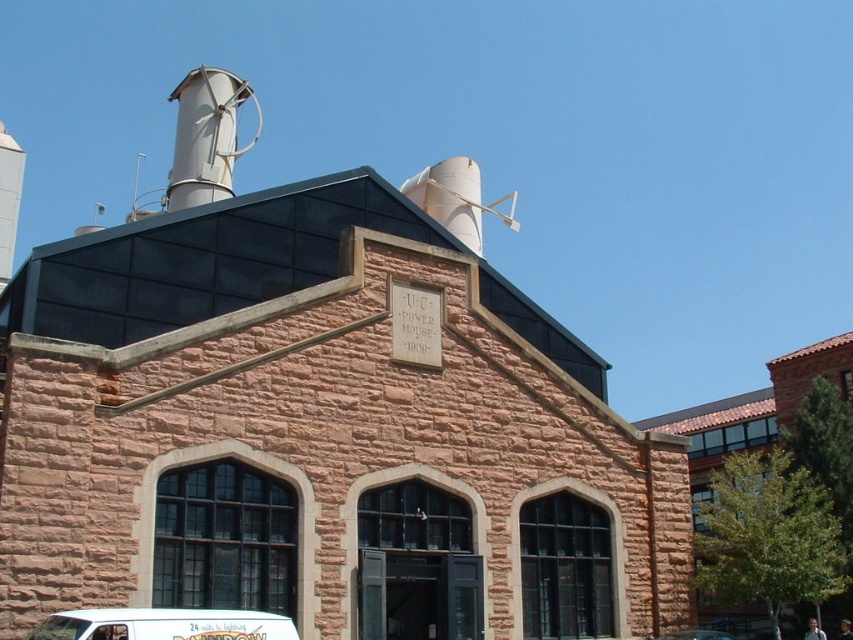
You are a delivery driver who needs to park your white matte van at center in front of the historic building. However, there is a metallic silver chimney at upper left in the way. Can you safely park your van without blocking the entrance?

The metallic silver chimney at upper left is further to the viewer than the white matte van at center, so the van can be parked in front of the building without blocking the entrance as the chimney is positioned behind the van from the driver perspective.

You are standing at the entrance of the historic building and see the point marked as point (164, 625). What object is located at this point?

The point (164, 625) corresponds to the white matte van at lower center.

In the scene shown: You are standing in front of the historic U.C. Power House 1909 building. There are two points marked on the building. The first point is at coordinates point (177, 625) and the second point is at point (689, 637). Which point is closer to you?

Point (177, 625) is closer to the camera than point (689, 637).